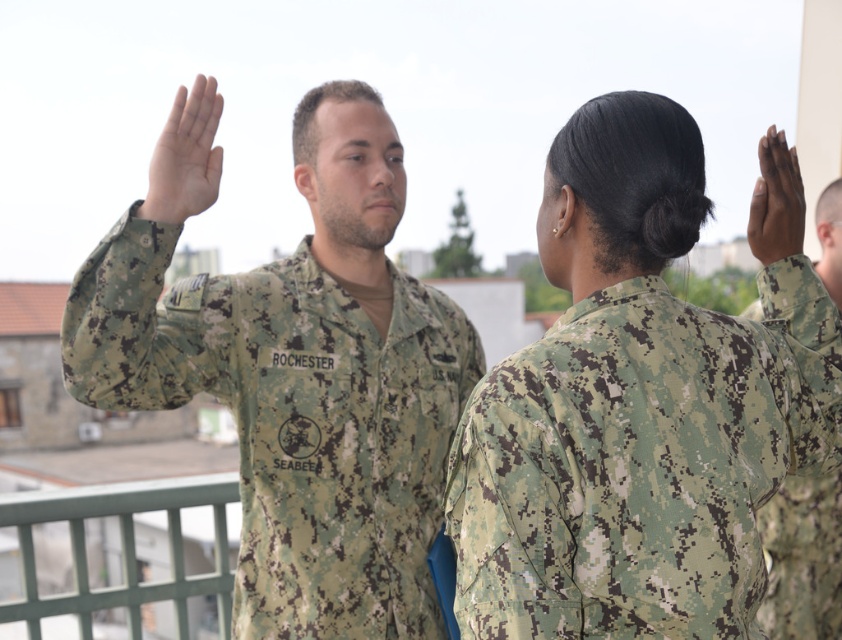
Based on the scene described, which object is wider, the camouflage fabric uniform at center or the matte green uniform at upper center?

The camouflage fabric uniform at center is wider than the matte green uniform at upper center according to the description.

You are a photographer positioned on the same balcony where the ceremony is taking place. You want to take a photo that includes both the matte green uniform at upper center and the dark brown matte skin at upper right. Which object should you adjust your camera focus on first to ensure both are in focus?

The matte green uniform at upper center is closer to the photographer than the dark brown matte skin at upper right. To ensure both are in focus, adjust the focus on the matte green uniform at upper center first, as it is closer, and the dark brown matte skin at upper right will naturally fall into focus afterward.